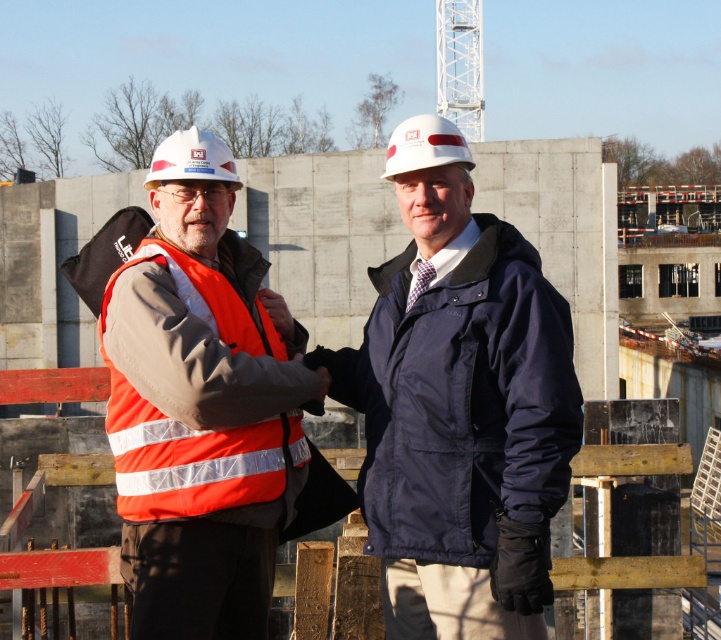
You are a safety inspector observing the construction site. You notice two items at the center of the scene. Which one is closer to you between the navy blue jacket at center and the white matte hard hat at center?

The navy blue jacket at center is closer to you because it is in front of the white matte hard hat at center.

You are a safety inspector on the construction site. You notice two items at the center of the scene. Which one is closer to you, the navy blue jacket at center or the white hard hat at center?

The navy blue jacket at center is closer to you since it is in front of the white hard hat at center.

You are an inspector on the construction site. You need to determine if the navy blue jacket at center can fit inside the white hard hat at center. Based on their sizes, can it?

The navy blue jacket at center is thinner than the white hard hat at center, so the navy blue jacket at center can fit inside the white hard hat at center since it has a smaller width.